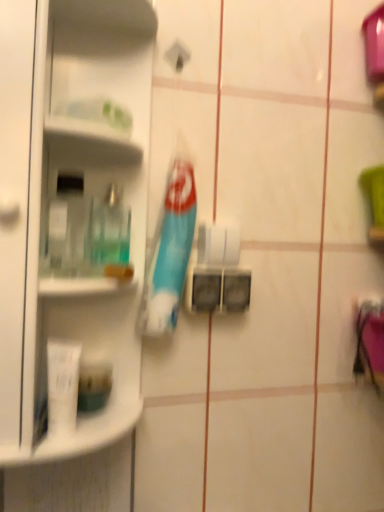
Question: Considering their positions, is white matte tube at lower left, acting as the first toiletry starting from the front, located in front of or behind blue plastic toothbrush at center?

Choices:
 (A) front
 (B) behind

Answer: (A)

Question: Is white matte tube at lower left, acting as the first toiletry starting from the front, taller or shorter than blue plastic toothbrush at center?

Choices:
 (A) short
 (B) tall

Answer: (A)

Question: Which is nearer to the clear plastic bottle at left?

Choices:
 (A) white matte tube at lower left, the second toiletry in the back-to-front sequence
 (B) translucent plastic mouthwash at left
 (C) white glossy shelf at upper left
 (D) matte green container at lower left, the second toiletry in the front-to-back sequence
 (E) white matte toilet paper at center

Answer: (B)

Question: Which of these objects is positioned farthest from the blue plastic toothbrush at center?

Choices:
 (A) clear plastic bottle at left
 (B) translucent plastic mouthwash at left
 (C) matte green container at lower left, the second toiletry in the front-to-back sequence
 (D) white matte tube at lower left, the second toiletry in the back-to-front sequence
 (E) white matte toilet paper at center

Answer: (D)